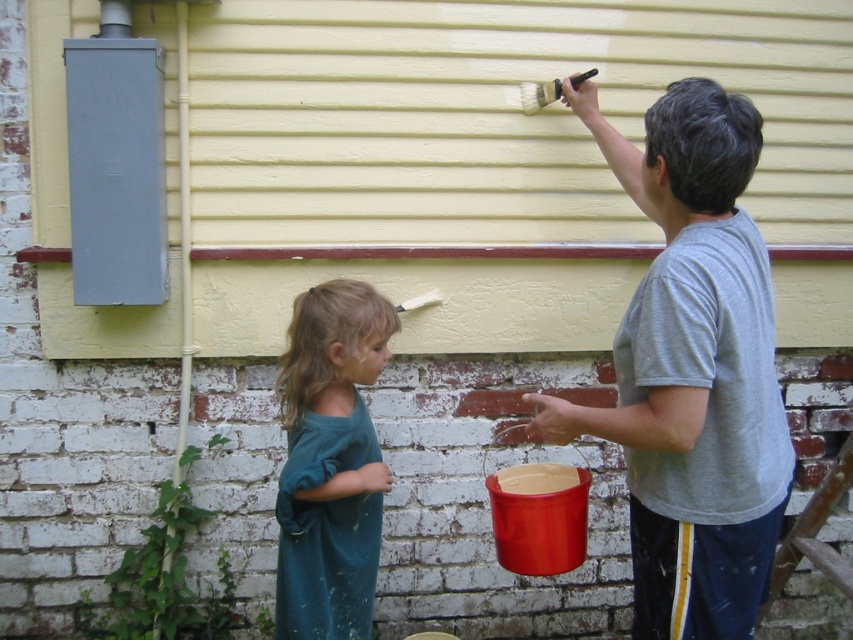
Which is more to the right, matte gray shirt at upper right or teal fabric shirt at lower left?

Positioned to the right is matte gray shirt at upper right.

Is matte gray shirt at upper right thinner than teal fabric shirt at lower left?

Incorrect, matte gray shirt at upper right's width is not less than teal fabric shirt at lower left's.

Which is behind, point (749, 492) or point (332, 499)?

Positioned behind is point (332, 499).

Where is `matte gray shirt at upper right`? matte gray shirt at upper right is located at coordinates (692, 371).